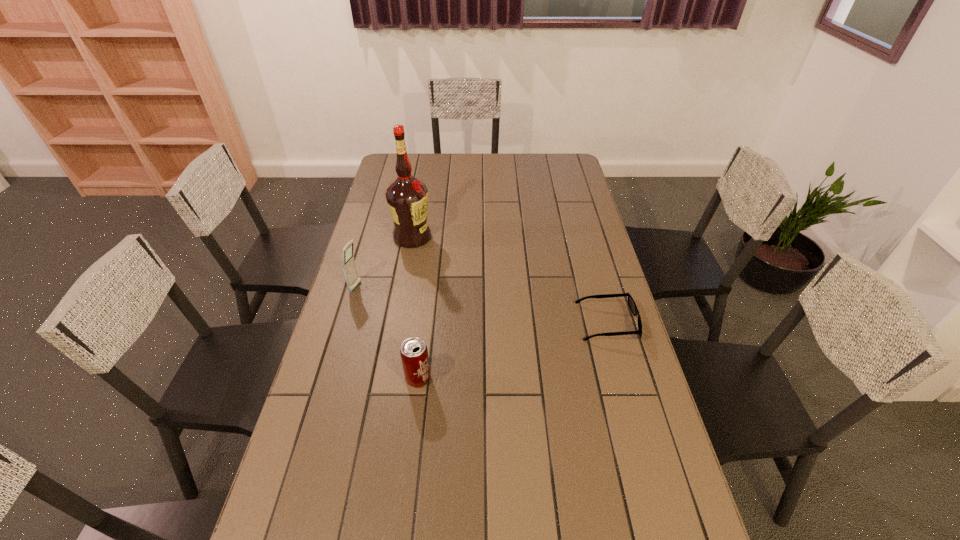
Where is `free region located on the front-facing side of the cellular telephone`? free region located on the front-facing side of the cellular telephone is located at coordinates (403, 301).

I want to click on blank area located 0.250m on the front-facing side of the cellular telephone, so click(x=428, y=308).

The height and width of the screenshot is (540, 960). I want to click on vacant space located 0.360m on the label of the farthest object, so click(x=470, y=308).

Identify the location of vacant space located on the label of the farthest object. The height and width of the screenshot is (540, 960). (435, 264).

Image resolution: width=960 pixels, height=540 pixels. I want to click on vacant space located 0.080m on the label of the farthest object, so click(x=431, y=260).

Image resolution: width=960 pixels, height=540 pixels. In order to click on cellular telephone present at the left edge in this screenshot , I will do click(x=349, y=267).

The image size is (960, 540). Find the location of `alcohol that is at the left edge`. alcohol that is at the left edge is located at coordinates (407, 197).

Find the location of a particular element. object located at the right edge is located at coordinates (631, 302).

Find the location of a particular element. The width and height of the screenshot is (960, 540). blank space at the far edge of the desktop is located at coordinates (461, 175).

The image size is (960, 540). I want to click on vacant space at the near edge, so click(x=548, y=524).